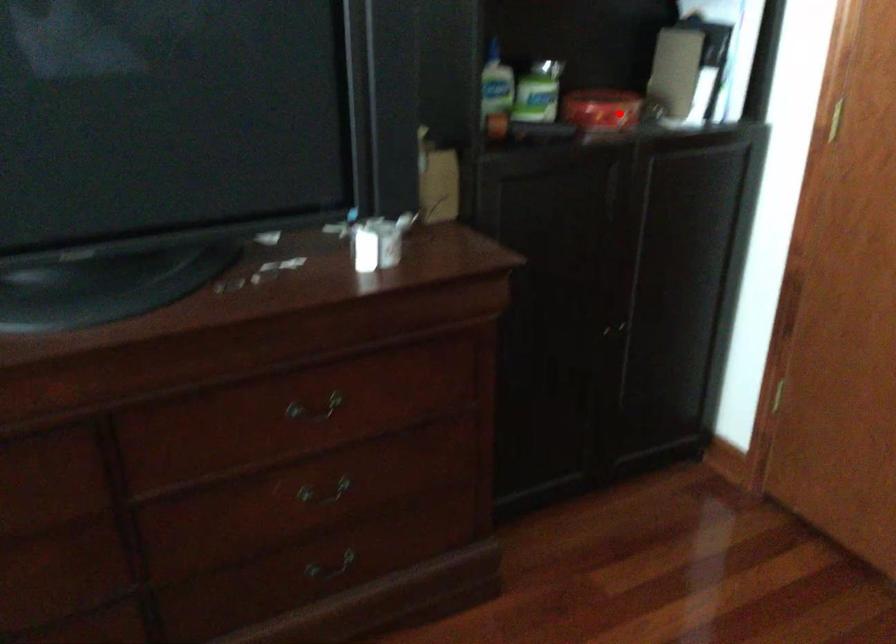
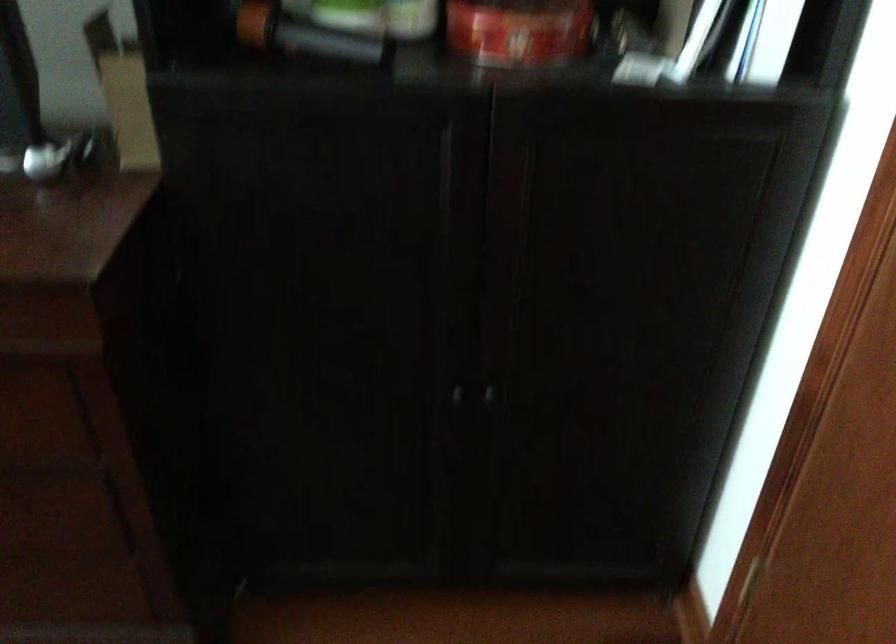
Question: I am providing you with two images of the same scene from different viewpoints. Image1 has a red point marked. In image2, the corresponding 3D location appears at what relative position? Reply with the corresponding letter.

Choices:
 (A) Closer
 (B) Farther

Answer: (A)